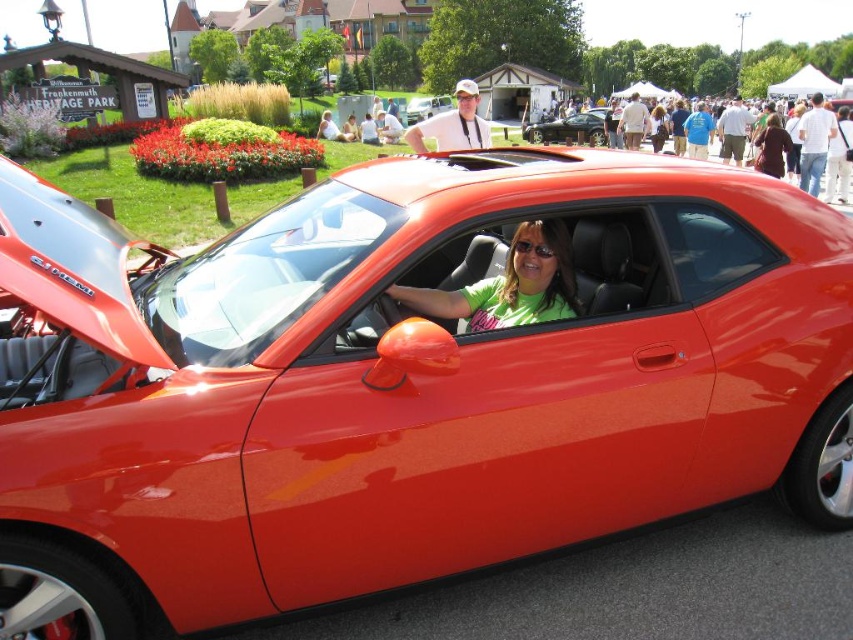
Is glossy black car at center to the left of matte brown jacket at center from the viewer's perspective?

No, glossy black car at center is not to the left of matte brown jacket at center.

Locate an element on the screen. glossy black car at center is located at coordinates (573, 128).

Which is below, green matte shirt at center or matte brown jacket at center?

green matte shirt at center

Is green matte shirt at center to the right of matte brown jacket at center from the viewer's perspective?

In fact, green matte shirt at center is to the left of matte brown jacket at center.

Measure the distance between point (512, 324) and camera.

Point (512, 324) and camera are 3.07 meters apart from each other.

I want to click on green matte shirt at center, so click(x=508, y=284).

Can you confirm if green matte shirt at center is positioned below glossy orange car at center?

Yes.

Describe the element at coordinates (508, 284) in the screenshot. I see `green matte shirt at center` at that location.

Where is `green matte shirt at center`? The width and height of the screenshot is (853, 640). green matte shirt at center is located at coordinates (508, 284).